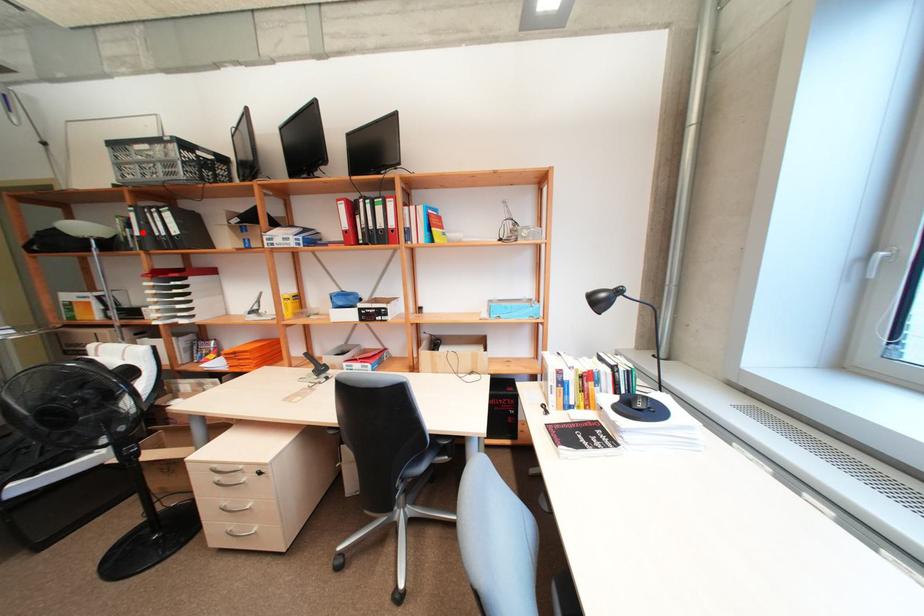
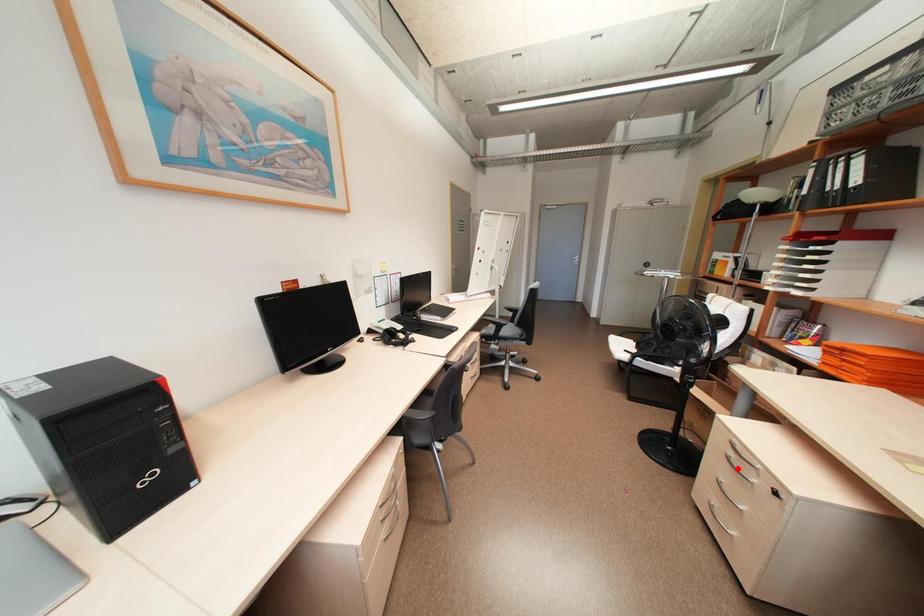
I am providing you with two images of the same scene from different viewpoints. A red point is marked on the first image and another point is marked on the second image. Does the point marked in image1 correspond to the same location as the one in image2?

No